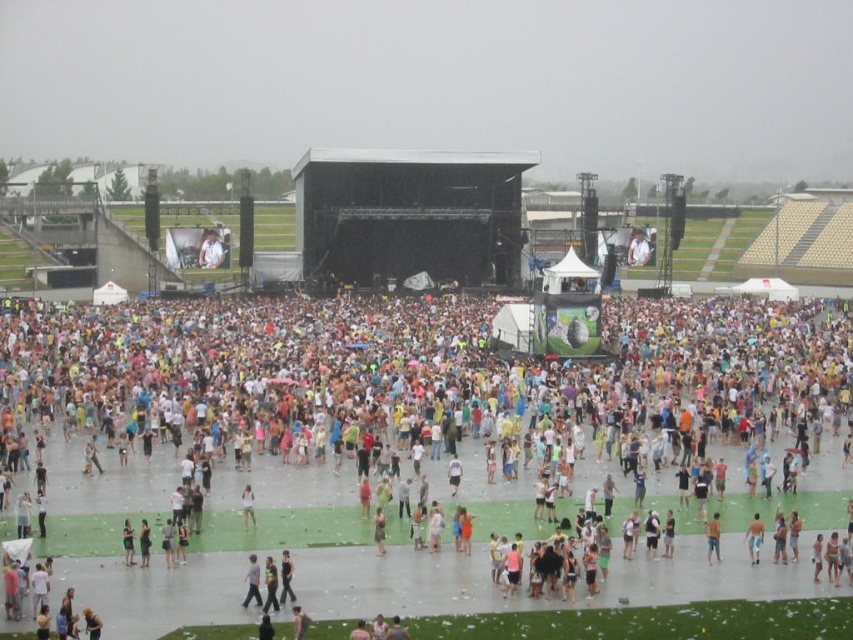
Question: Does light brown leather jacket at center appear on the left side of white matte dress at center?

Choices:
 (A) no
 (B) yes

Answer: (A)

Question: Can you confirm if white cotton t-shirt at center is positioned to the right of white matte dress at center?

Choices:
 (A) no
 (B) yes

Answer: (B)

Question: Among these objects, which one is nearest to the camera?

Choices:
 (A) white matte dress at center
 (B) white cotton t-shirt at center

Answer: (B)

Question: Is white cotton t-shirt at center positioned in front of light brown leather jacket at center?

Choices:
 (A) no
 (B) yes

Answer: (B)

Question: Which point appears farthest from the camera in this image?

Choices:
 (A) (242, 504)
 (B) (253, 582)
 (C) (614, 481)

Answer: (C)

Question: Which object is farther from the camera taking this photo?

Choices:
 (A) light brown leather jacket at center
 (B) white cotton t-shirt at center
 (C) white matte dress at center

Answer: (C)